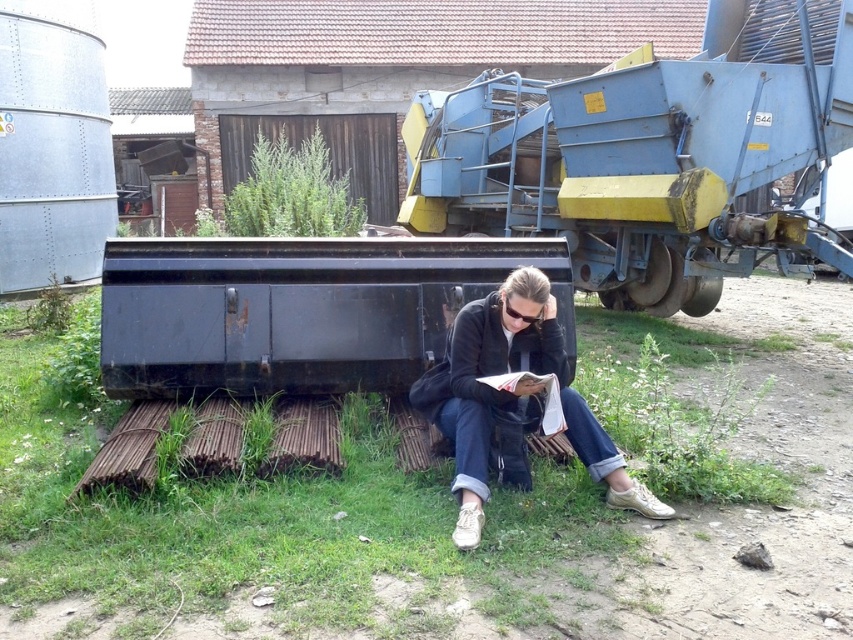
You are standing in the rural area shown in the image and want to place a small marker between the two points, point (792, 292) and point (451, 397). Which point is closer to you so that you can place the marker correctly?

Point (792, 292) is further to the viewer than point (451, 397), so the closer point to you is point (451, 397). Place the marker between them by starting from point (451, 397) which is nearer.

You are standing in the rural area shown in the image. You see the green grass at lower center and the denim jeans at lower center. Which object is positioned to the left?

The green grass at lower center is to the left of denim jeans at lower center.

You are a farmer who needs to move the green grass at lower center to the storage area located 15 feet away from the current position. Can you move it directly without moving the agricultural machine first?

The green grass at lower center is 12.60 feet away from the agricultural machine. Since the storage area is 15 feet away, you can move the green grass directly to the storage area without moving the agricultural machine first, as the distance is within reach.